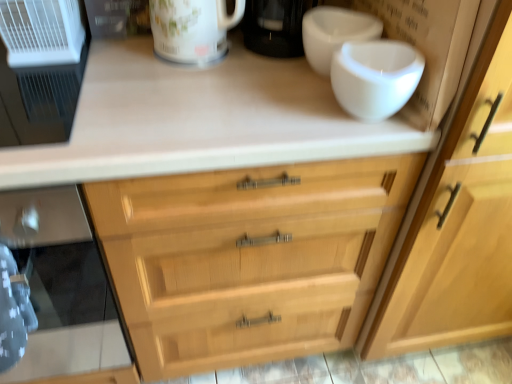
Identify the location of vacant space that is to the left of white glossy bowl at upper right. (250, 86).